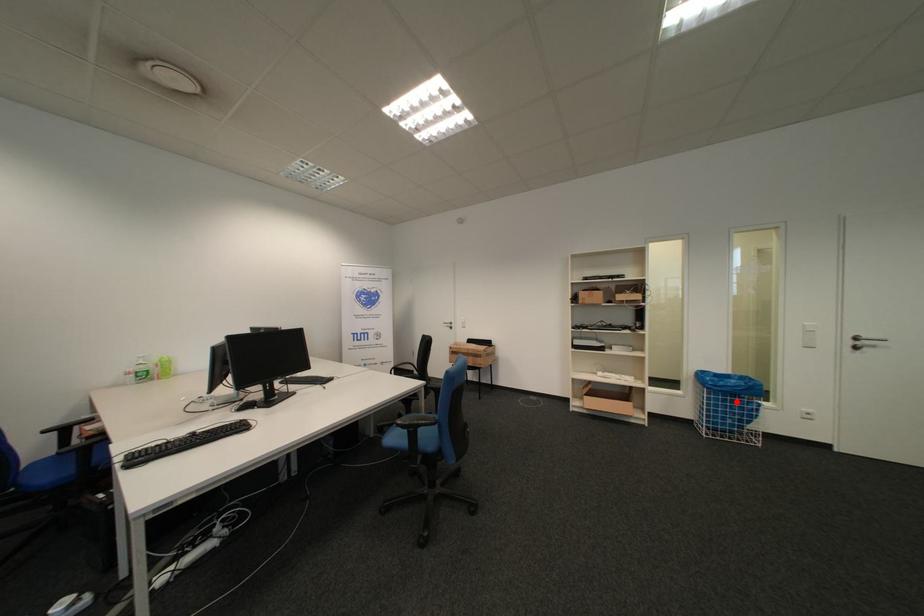
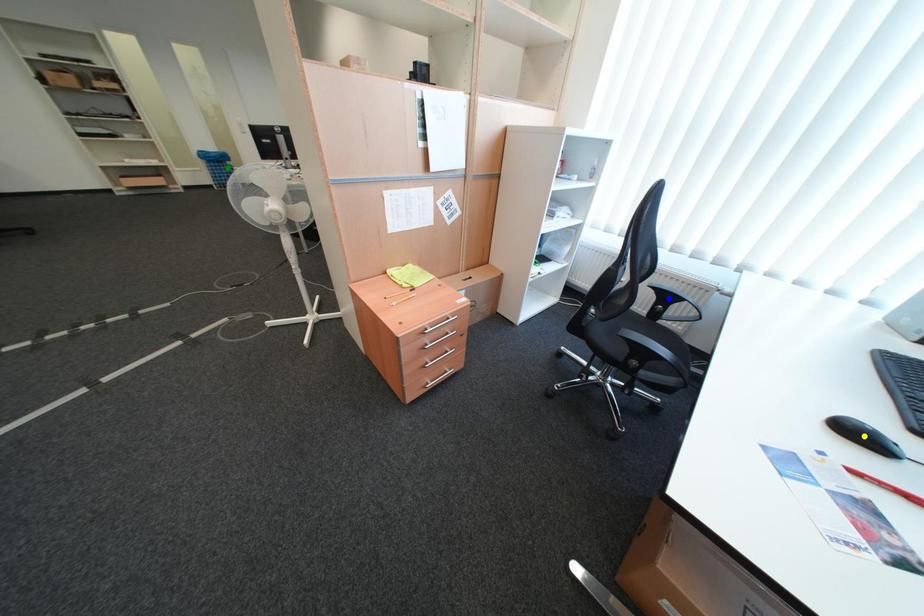
Question: I am providing you with two images of the same scene from different viewpoints. A red point is marked on the first image. You are given multiple points on the second image. Which mark in image 2 goes with the point in image 1?

Choices:
 (A) green point
 (B) blue point
 (C) yellow point

Answer: (A)